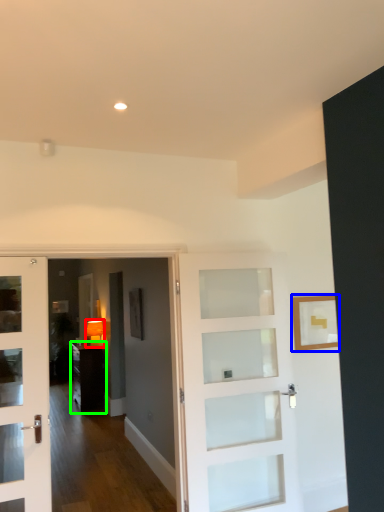
Question: Which object is positioned farthest from lamp (highlighted by a red box)? Select from picture frame (highlighted by a blue box) and furniture (highlighted by a green box).

Choices:
 (A) picture frame
 (B) furniture

Answer: (A)